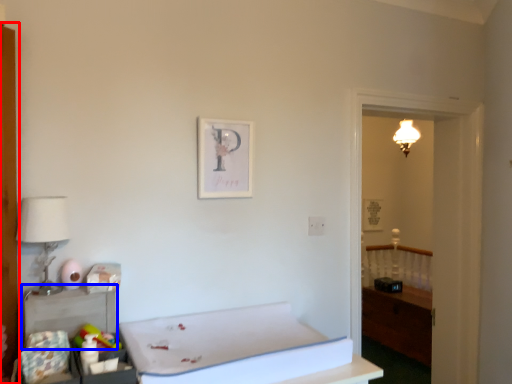
Question: Which object is further to the camera taking this photo, armoire (highlighted by a red box) or table (highlighted by a blue box)?

Choices:
 (A) armoire
 (B) table

Answer: (A)